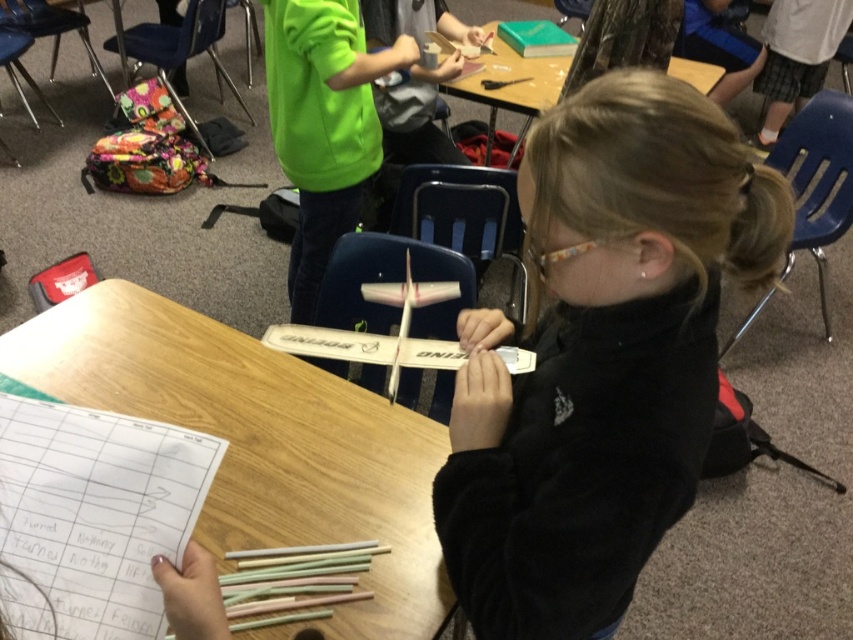
The point at coordinates (x=601, y=355) is located where in the image?

The point at coordinates (x=601, y=355) indicates the location of the black matte airplane at center.

You are a student in the classroom and need to place both the black matte airplane at center and the green matte book at upper center into a storage box. The box has a height limit of 10 cm. Which object might not fit if the airplane is 12 cm tall?

The black matte airplane at center might not fit into the storage box since it has a greater height compared to the green matte book at upper center and is 12 cm tall, exceeding the 10 cm height limit.